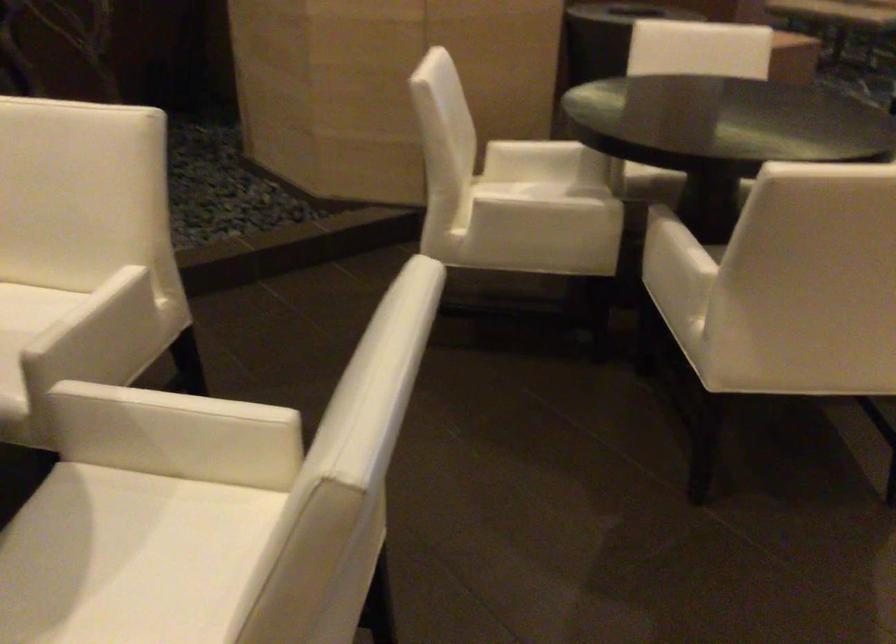
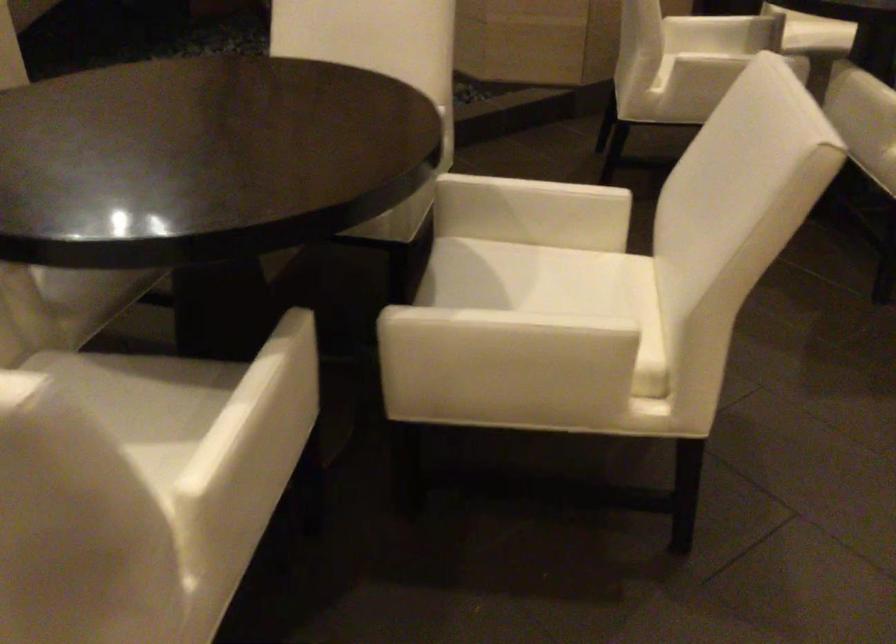
Locate, in the second image, the point that corresponds to [509,187] in the first image.

(687, 43)